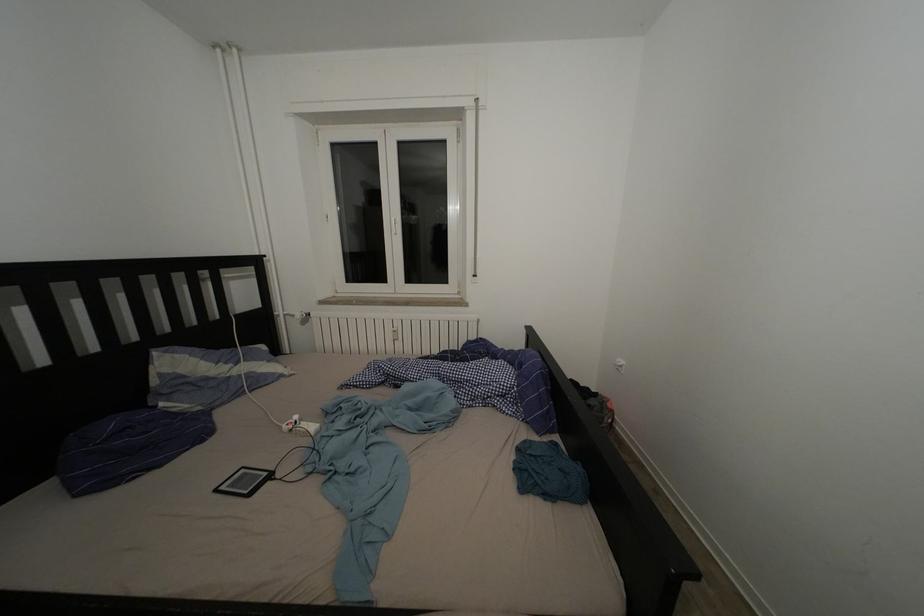
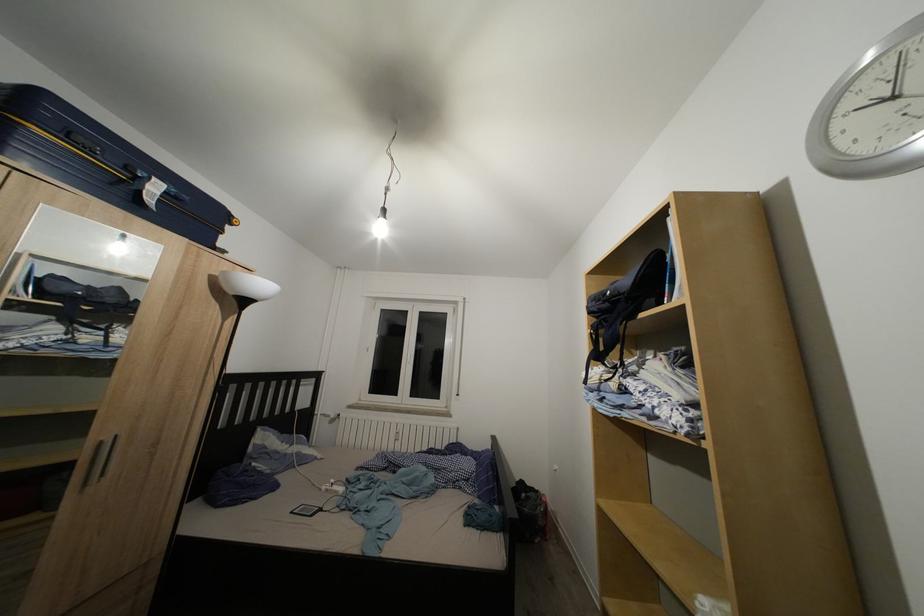
Question: Which direction would the cameraman need to move to produce the second image? Reply with the corresponding letter.

Choices:
 (A) Left
 (B) Right
 (C) Forward
 (D) Backward

Answer: (D)